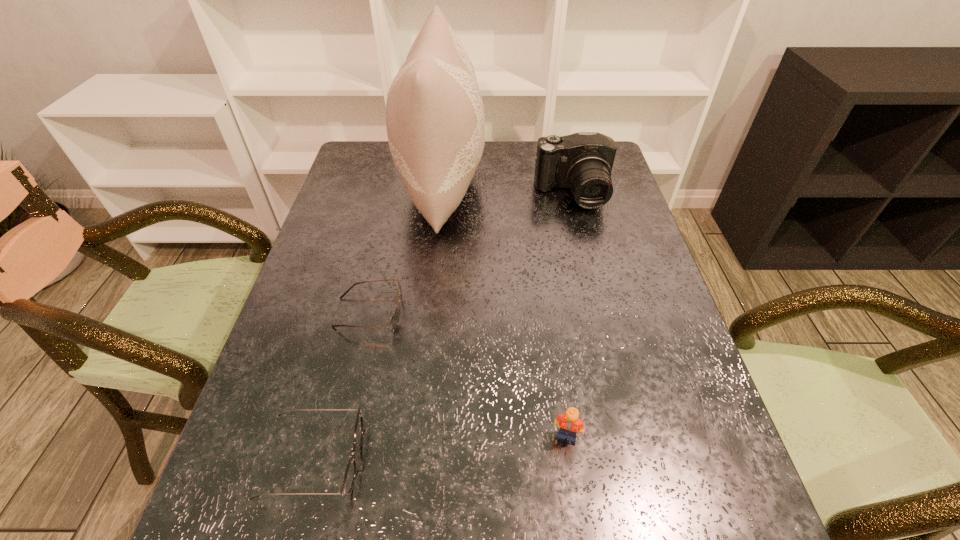
Select which object is the closest to the third nearest object. Please provide its 2D coordinates. Your answer should be formatted as a tuple, i.e. [(x, y)], where the tuple contains the x and y coordinates of a point satisfying the conditions above.

[(435, 121)]

At what (x,y) coordinates should I click in order to perform the action: click on object that is the closest to the third nearest object. Please return your answer as a coordinate pair (x, y). This screenshot has width=960, height=540. Looking at the image, I should click on pyautogui.click(x=435, y=121).

Where is `vacant region that satisfies the following two spatial constraints: 1. on the front-facing side of the Lego; 2. through the lenses of the spectacles`? This screenshot has width=960, height=540. vacant region that satisfies the following two spatial constraints: 1. on the front-facing side of the Lego; 2. through the lenses of the spectacles is located at coordinates (570, 460).

Find the location of a particular element. This screenshot has height=540, width=960. free location that satisfies the following two spatial constraints: 1. on the front-facing side of the Lego; 2. through the lenses of the spectacles is located at coordinates (570, 460).

Where is `vacant space that satisfies the following two spatial constraints: 1. on the lens of the camera; 2. through the lenses of the spectacles`? Image resolution: width=960 pixels, height=540 pixels. vacant space that satisfies the following two spatial constraints: 1. on the lens of the camera; 2. through the lenses of the spectacles is located at coordinates (639, 460).